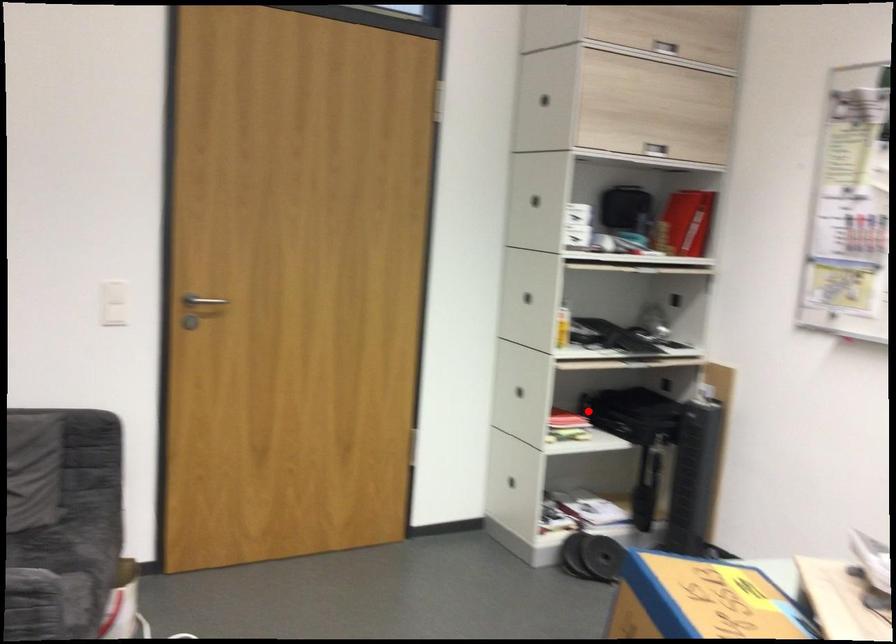
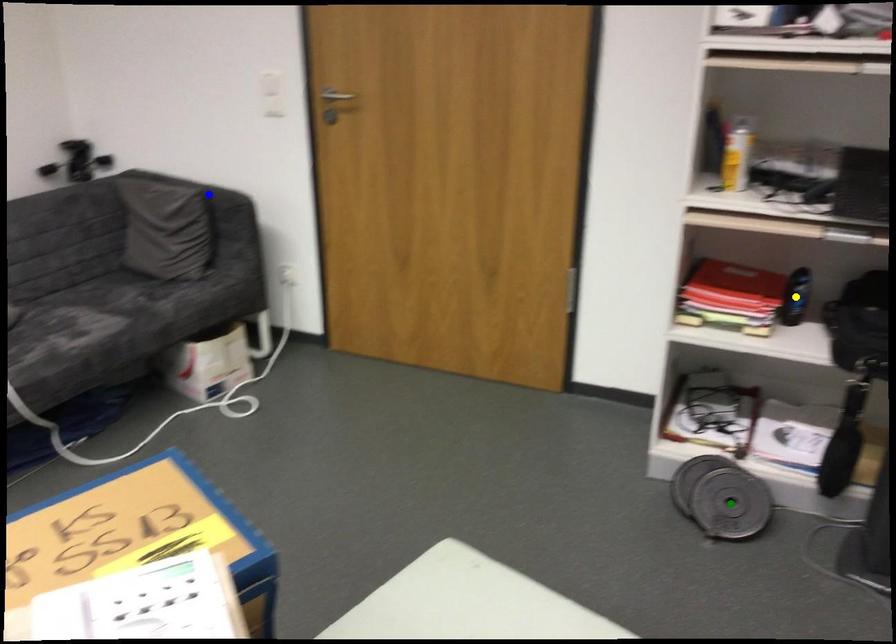
Question: I am providing you with two images of the same scene from different viewpoints. A red point is marked on the first image. You are given multiple points on the second image. Which mark in image 2 goes with the point in image 1?

Choices:
 (A) yellow point
 (B) blue point
 (C) green point

Answer: (A)